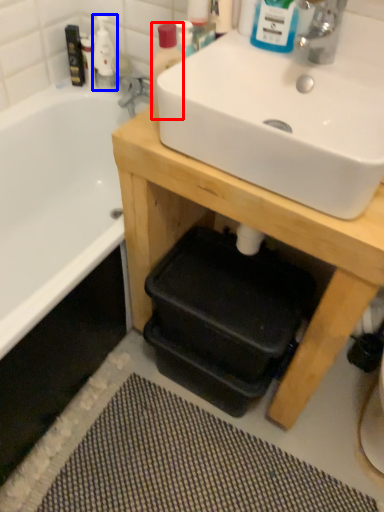
Question: Among these objects, which one is farthest to the camera, bottle (highlighted by a red box) or cleaning product (highlighted by a blue box)?

Choices:
 (A) bottle
 (B) cleaning product

Answer: (B)